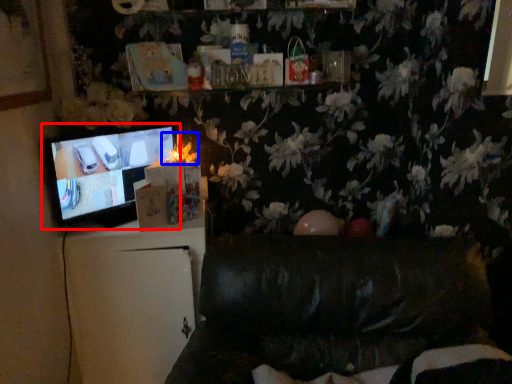
Question: Which object is further to the camera taking this photo, television (highlighted by a red box) or flower (highlighted by a blue box)?

Choices:
 (A) television
 (B) flower

Answer: (B)